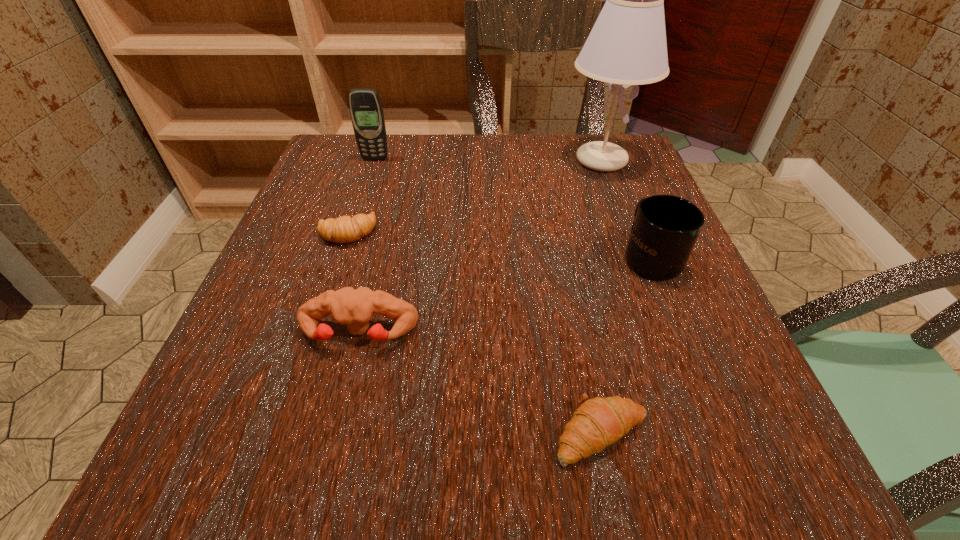
Find the location of a particular element. puncher at the left edge is located at coordinates (354, 308).

Image resolution: width=960 pixels, height=540 pixels. I want to click on crescent roll located in the left edge section of the desktop, so click(x=344, y=229).

Find the location of a particular element. lampshade situated at the right edge is located at coordinates (627, 45).

Locate an element on the screen. mug that is at the right edge is located at coordinates (665, 229).

The width and height of the screenshot is (960, 540). Find the location of `crescent roll that is at the right edge`. crescent roll that is at the right edge is located at coordinates (599, 422).

You are a GUI agent. You are given a task and a screenshot of the screen. Output one action in this format:
    pyautogui.click(x=<x>, y=<y>)
    Task: Click on the object at the far left corner
    This screenshot has width=960, height=540.
    Given the screenshot: What is the action you would take?
    point(366,111)

This screenshot has width=960, height=540. In order to click on object that is at the far right corner in this screenshot , I will do `click(627, 45)`.

Locate an element on the screen. This screenshot has height=540, width=960. object located at the near right corner is located at coordinates (599, 422).

The height and width of the screenshot is (540, 960). Identify the location of free region at the far edge. (544, 147).

In the image, there is a desktop. Identify the location of free space at the near edge. This screenshot has width=960, height=540. (555, 443).